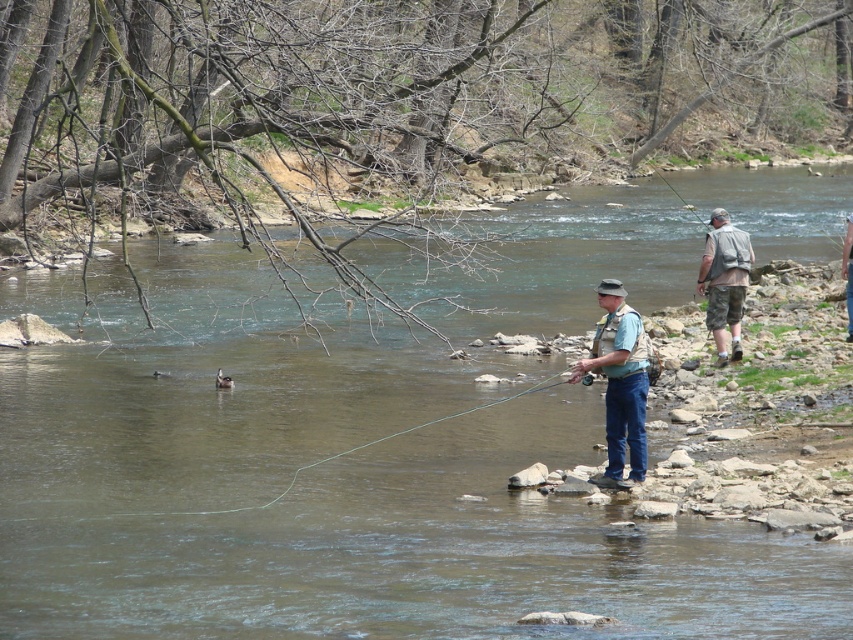
Is point (737, 276) less distant than point (851, 278)?

Yes.

Does gray fabric vest at right have a lesser height compared to light blue fabric vest at center?

Incorrect, gray fabric vest at right's height does not fall short of light blue fabric vest at center's.

Is point (738, 353) in front of point (848, 307)?

Yes.

Locate an element on the screen. The width and height of the screenshot is (853, 640). gray fabric vest at right is located at coordinates (724, 282).

Is clear water at river center below light blue fabric vest at center?

No, clear water at river center is not below light blue fabric vest at center.

Between clear water at river center and light blue fabric vest at center, which one appears on the left side from the viewer's perspective?

clear water at river center

Is point (535, 209) more distant than point (849, 244)?

That is True.

Locate an element on the screen. This screenshot has width=853, height=640. clear water at river center is located at coordinates (335, 486).

Does light blue fabric shirt at center appear on the left side of gray fabric vest at right?

Indeed, light blue fabric shirt at center is positioned on the left side of gray fabric vest at right.

Can you confirm if light blue fabric shirt at center is bigger than gray fabric vest at right?

Correct, light blue fabric shirt at center is larger in size than gray fabric vest at right.

Locate an element on the screen. light blue fabric shirt at center is located at coordinates (619, 381).

In order to click on light blue fabric shirt at center in this screenshot , I will do `click(619, 381)`.